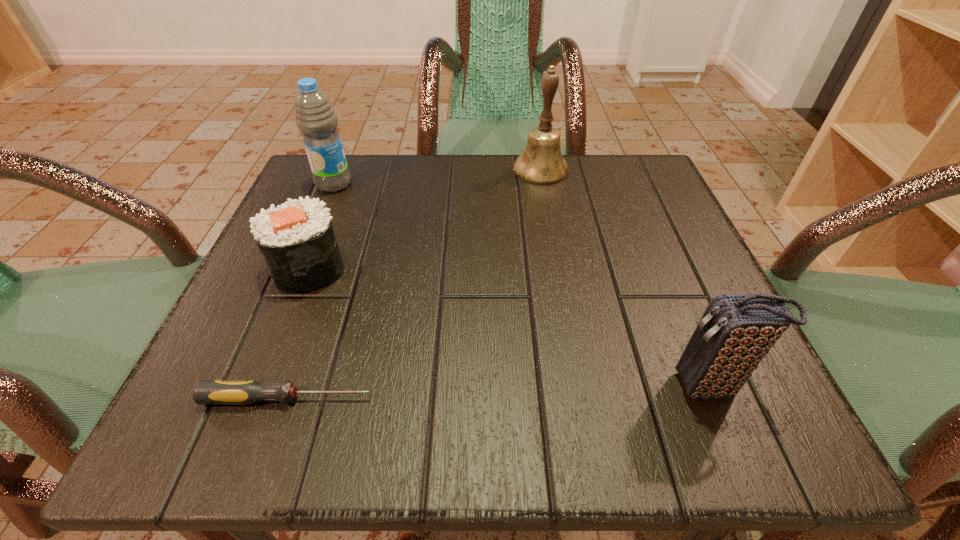
Where is `vacant region at the far right corner of the desktop`? The image size is (960, 540). vacant region at the far right corner of the desktop is located at coordinates (644, 219).

Find the location of a particular element. The height and width of the screenshot is (540, 960). vacant area between the second object from right to left and the third shortest object is located at coordinates (625, 278).

You are a GUI agent. You are given a task and a screenshot of the screen. Output one action in this format:
    pyautogui.click(x=<x>, y=<y>)
    Task: Click on the vacant space that's between the shortest object and the second shortest object
    
    Given the screenshot: What is the action you would take?
    [x=299, y=333]

Find the location of a particular element. The width and height of the screenshot is (960, 540). free spot between the water bottle and the third shortest object is located at coordinates (522, 285).

Where is `free point between the water bottle and the third shortest object`? Image resolution: width=960 pixels, height=540 pixels. free point between the water bottle and the third shortest object is located at coordinates (522, 285).

Locate an element on the screen. The image size is (960, 540). empty location between the shortest object and the fourth object from left to right is located at coordinates (415, 284).

Locate an element on the screen. The height and width of the screenshot is (540, 960). empty space that is in between the third shortest object and the third farthest object is located at coordinates tap(509, 327).

Locate an element on the screen. empty location between the third tallest object and the screwdriver is located at coordinates (499, 393).

I want to click on vacant area that lies between the clutch bag and the fourth tallest object, so click(509, 327).

Image resolution: width=960 pixels, height=540 pixels. I want to click on free space between the rightmost object and the second shortest object, so click(509, 327).